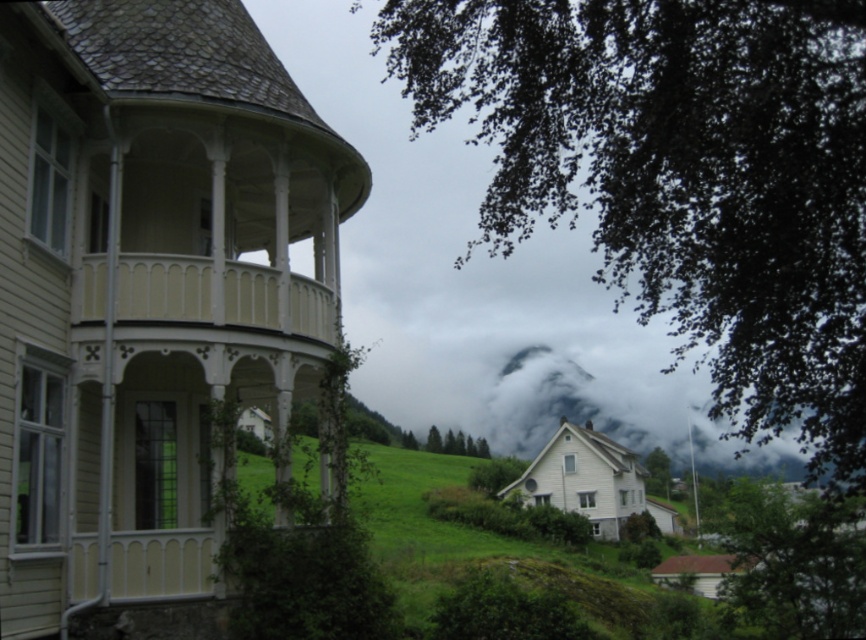
Is point (118, 356) positioned before point (437, 451)?

Yes, point (118, 356) is closer to viewer.

Is matte white gazebo at center shorter than green leafy tree at center?

Incorrect, matte white gazebo at center's height does not fall short of green leafy tree at center's.

Describe the element at coordinates (146, 285) in the screenshot. I see `matte white gazebo at center` at that location.

This screenshot has height=640, width=866. I want to click on matte white gazebo at center, so coord(146,285).

Is point (36, 186) positioned in front of point (790, 84)?

No, it is behind (790, 84).

Who is positioned more to the right, matte white gazebo at center or green leafy tree at upper left?

Positioned to the right is green leafy tree at upper left.

Is point (87, 0) positioned behind point (634, 113)?

No, (87, 0) is closer to viewer.

At what (x,y) coordinates should I click in order to perform the action: click on matte white gazebo at center. Please return your answer as a coordinate pair (x, y). The width and height of the screenshot is (866, 640). Looking at the image, I should click on (146, 285).

How much distance is there between green leafy tree at upper left and green leafy tree at center?

green leafy tree at upper left is 51.74 meters away from green leafy tree at center.

Who is shorter, green leafy tree at upper left or green leafy tree at center?

With less height is green leafy tree at center.

Is point (670, 275) less distant than point (430, 440)?

Yes.

Locate an element on the screen. green leafy tree at upper left is located at coordinates (692, 209).